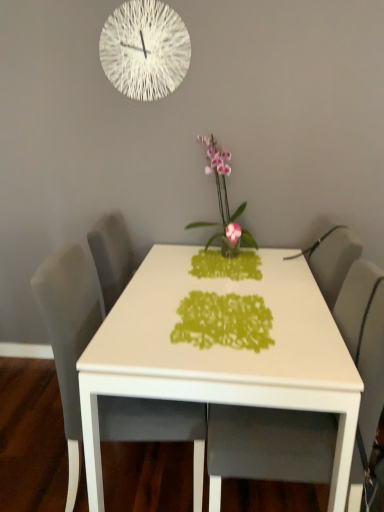
Question: Is white glossy table at center bigger or smaller than green paper cutout at center?

Choices:
 (A) small
 (B) big

Answer: (B)

Question: Does point tap(246, 395) appear closer or farther from the camera than point tap(208, 294)?

Choices:
 (A) farther
 (B) closer

Answer: (B)

Question: Which object is positioned farthest from the white glossy table at center?

Choices:
 (A) white textured clock at upper center
 (B) gray fabric chair at center, which ranks as the 1th chair in right-to-left order
 (C) green paper cutout at center
 (D) pink glossy orchid at center
 (E) gray fabric chair at left, which is the first chair from left to right

Answer: (A)

Question: Which object is the farthest from the white textured clock at upper center?

Choices:
 (A) gray fabric chair at left, placed as the 2th chair when sorted from right to left
 (B) green paper cutout at center
 (C) white glossy table at center
 (D) gray fabric chair at center, which ranks as the 1th chair in right-to-left order
 (E) pink glossy orchid at center

Answer: (D)